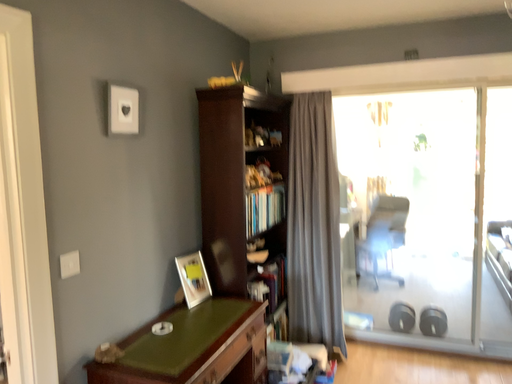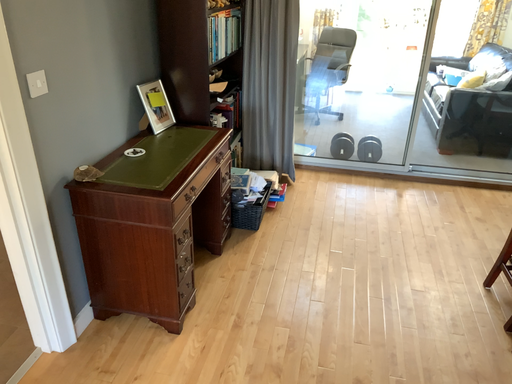
Question: Which way did the camera rotate in the video?

Choices:
 (A) rotated downward
 (B) rotated upward

Answer: (A)